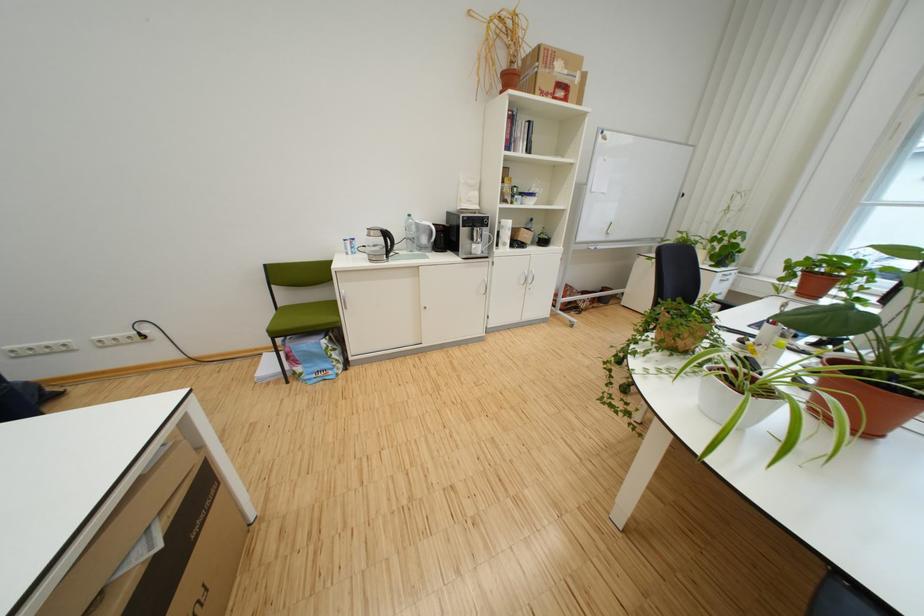
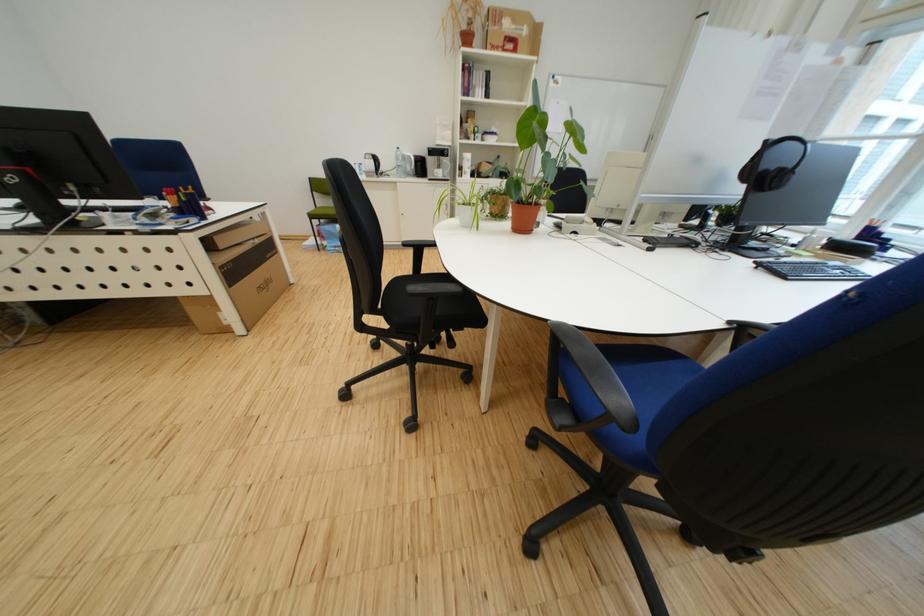
The images are taken continuously from a first-person perspective. In which direction are you moving?

The cameraman walked toward right, backward.